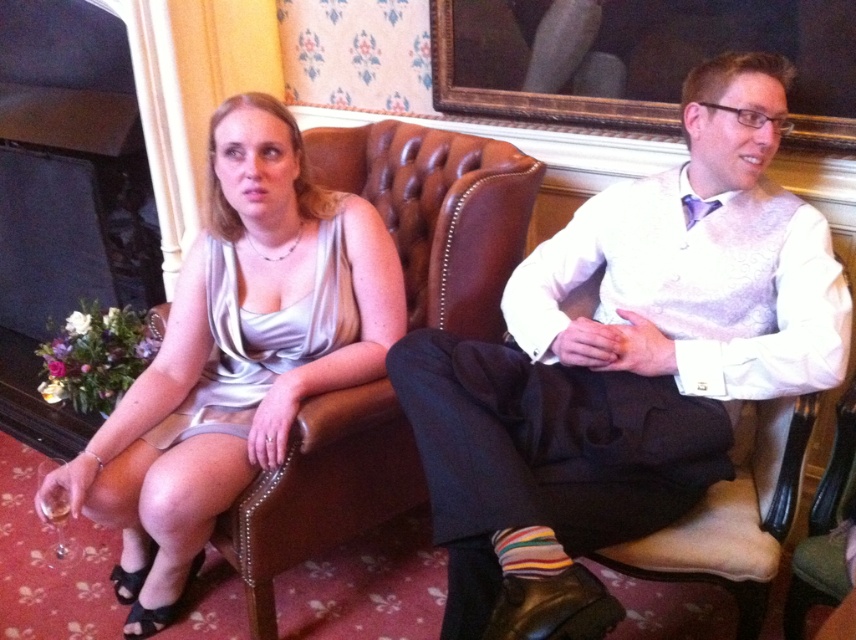
You are a photographer setting up for a formal event. You need to position a camera to capture both the wooden framed mirror at upper center and the satin dress at left in the same shot. Based on their positions, which object should you focus on first to ensure both are in frame?

The wooden framed mirror at upper center is above the satin dress at left, so you should focus on the wooden framed mirror at upper center first to ensure both are in frame.

You are a photographer who needs to capture a closeup of the wooden framed mirror at upper center and the satin dress at left. Given that your camera can only focus on one object at a time, which object should you focus on first to ensure it fills the frame more?

The wooden framed mirror at upper center is bigger than the satin dress at left, so you should focus on the wooden framed mirror at upper center first to ensure it fills the frame more.